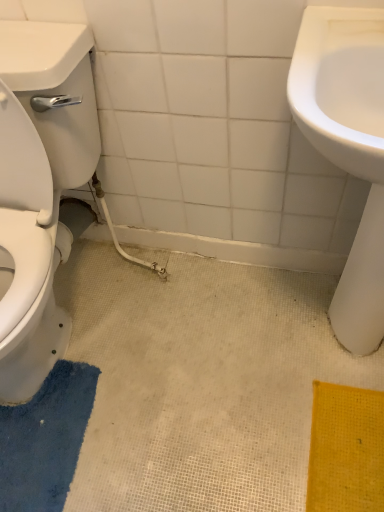
Question: Should I look upward or downward to see white glossy toilet at left?

Choices:
 (A) down
 (B) up

Answer: (B)

Question: Is blue textured bath mat at lower left with white glossy sink at right?

Choices:
 (A) no
 (B) yes

Answer: (A)

Question: From a real-world perspective, is blue textured bath mat at lower left positioned under white glossy sink at right based on gravity?

Choices:
 (A) no
 (B) yes

Answer: (B)

Question: From a real-world perspective, does blue textured bath mat at lower left stand above white glossy sink at right?

Choices:
 (A) yes
 (B) no

Answer: (B)

Question: Is blue textured bath mat at lower left shorter than white glossy sink at right?

Choices:
 (A) yes
 (B) no

Answer: (A)

Question: Can you confirm if blue textured bath mat at lower left is thinner than white glossy sink at right?

Choices:
 (A) yes
 (B) no

Answer: (A)

Question: Can you confirm if blue textured bath mat at lower left is positioned to the right of white glossy sink at right?

Choices:
 (A) yes
 (B) no

Answer: (B)

Question: From a real-world perspective, is white glossy sink at right physically above blue textured bath mat at lower left?

Choices:
 (A) yes
 (B) no

Answer: (A)

Question: Considering the relative sizes of white glossy sink at right and blue textured bath mat at lower left in the image provided, is white glossy sink at right shorter than blue textured bath mat at lower left?

Choices:
 (A) no
 (B) yes

Answer: (A)

Question: Does white glossy sink at right have a smaller size compared to blue textured bath mat at lower left?

Choices:
 (A) no
 (B) yes

Answer: (A)

Question: Would you say white glossy sink at right is outside blue textured bath mat at lower left?

Choices:
 (A) no
 (B) yes

Answer: (B)

Question: From the image's perspective, is white glossy sink at right located beneath blue textured bath mat at lower left?

Choices:
 (A) yes
 (B) no

Answer: (B)

Question: Could you tell me if white glossy sink at right is facing blue textured bath mat at lower left?

Choices:
 (A) no
 (B) yes

Answer: (A)

Question: Is blue textured bath mat at lower left far away from white glossy toilet at left?

Choices:
 (A) no
 (B) yes

Answer: (A)